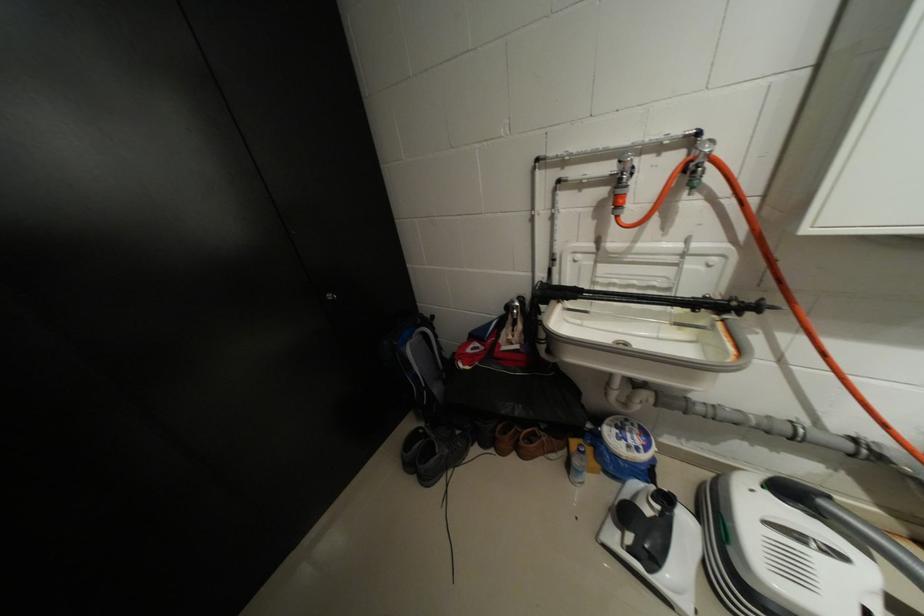
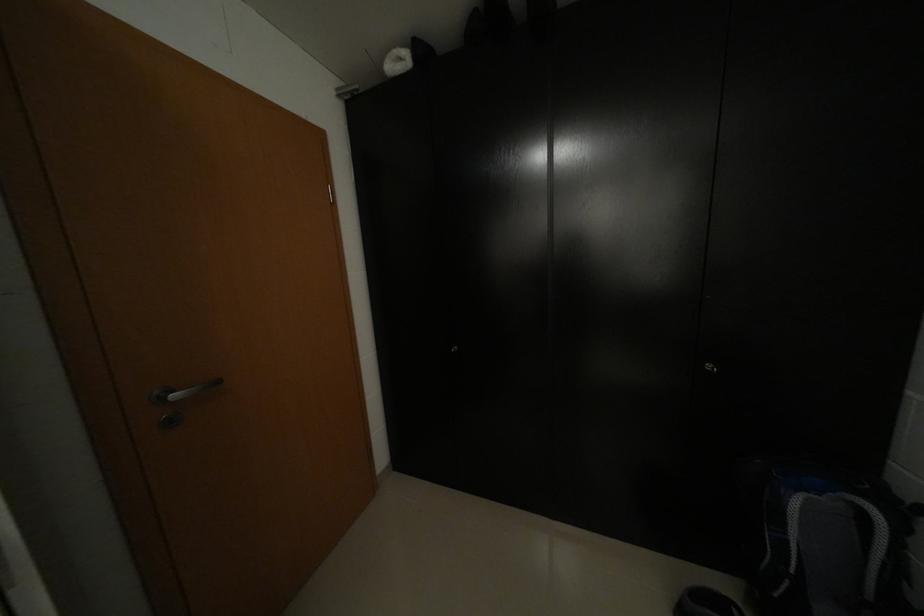
The point at (427, 326) is marked in the first image. Where is the corresponding point in the second image?

(867, 495)